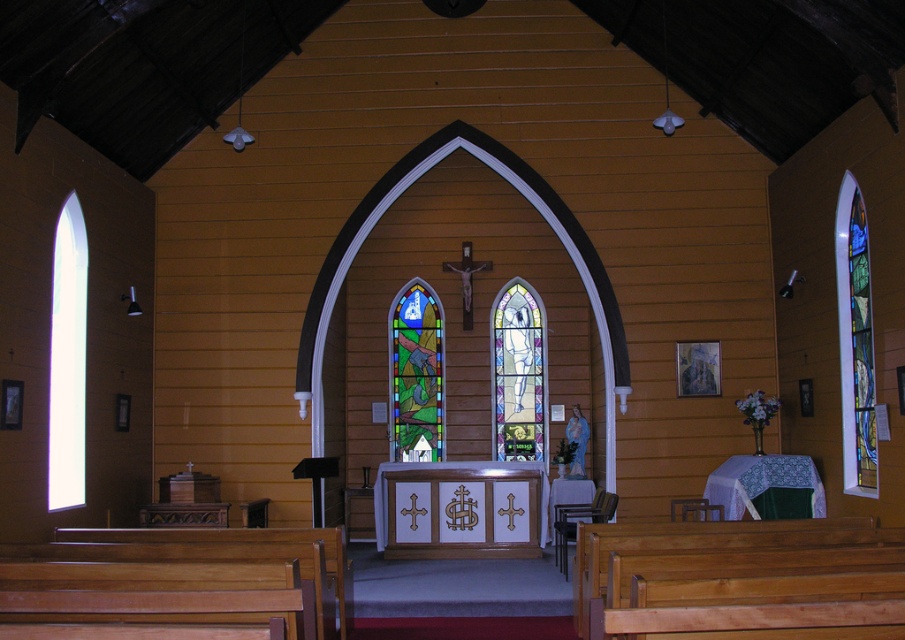
Question: Does stained glass window at right have a lesser width compared to stained glass window at center?

Choices:
 (A) yes
 (B) no

Answer: (A)

Question: From the image, what is the correct spatial relationship of light brown wooden bench at lower right in relation to transparent glass window at left?

Choices:
 (A) below
 (B) above

Answer: (A)

Question: Among these points, which one is nearest to the camera?

Choices:
 (A) (839, 337)
 (B) (496, 310)

Answer: (A)

Question: Which object is positioned farthest from the translucent stained glass at center?

Choices:
 (A) stained glass window at right
 (B) transparent glass window at left
 (C) light brown wooden bench at lower right
 (D) stained glass window at center

Answer: (C)

Question: Can you confirm if light brown wooden bench at lower right is positioned to the left of stained glass window at right?

Choices:
 (A) no
 (B) yes

Answer: (B)

Question: Which point is farther to the camera?

Choices:
 (A) (499, 458)
 (B) (729, 532)

Answer: (A)